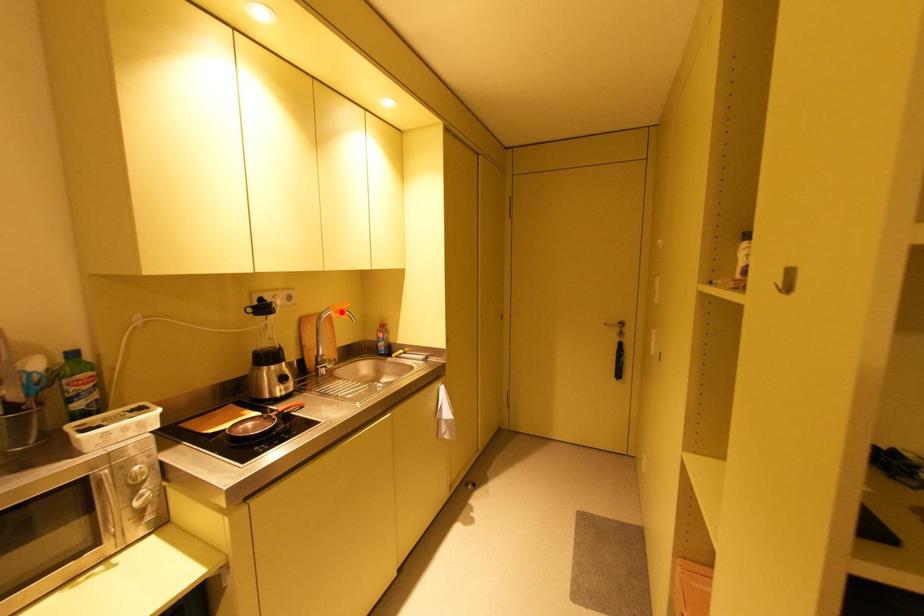
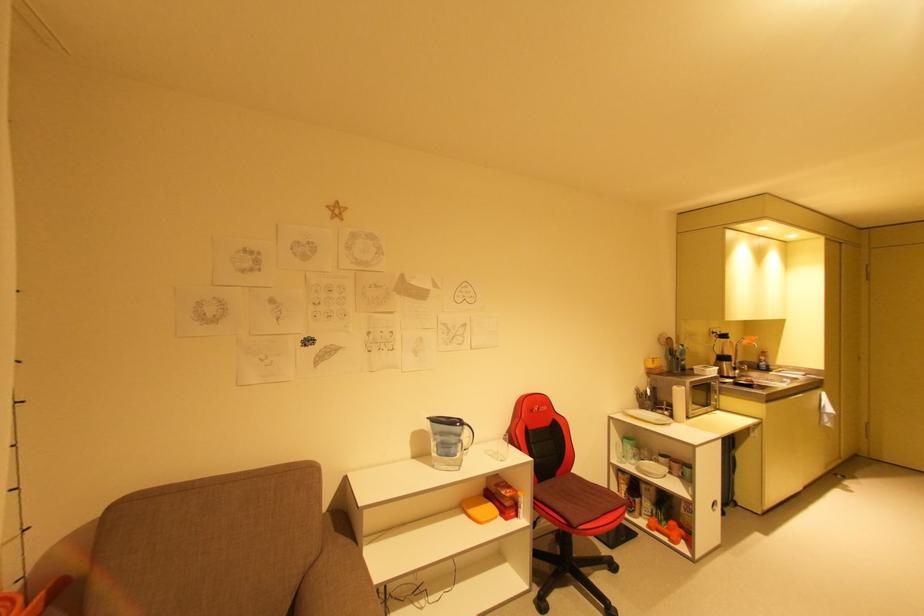
Locate, in the second image, the point that corresponds to the highlighted location in the first image.

(756, 341)